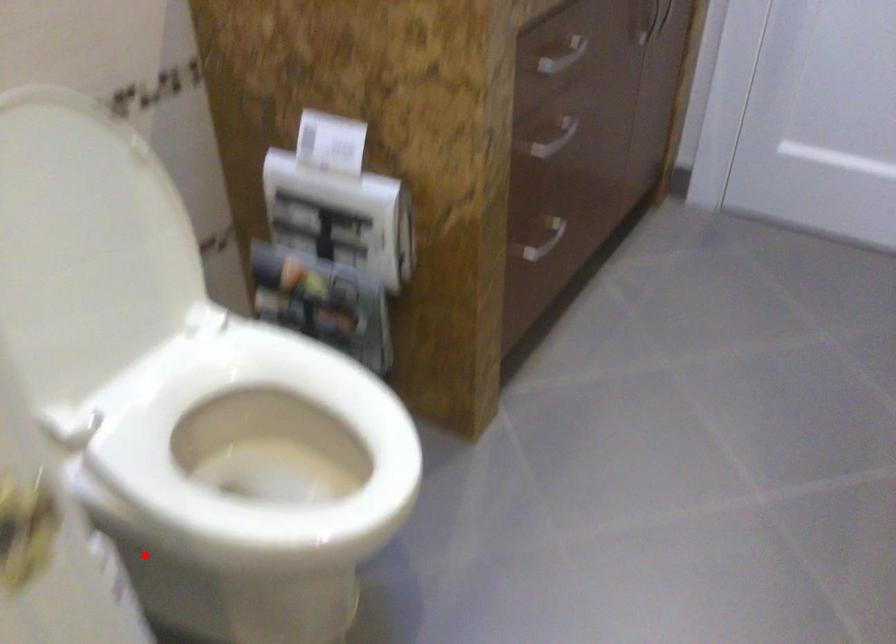
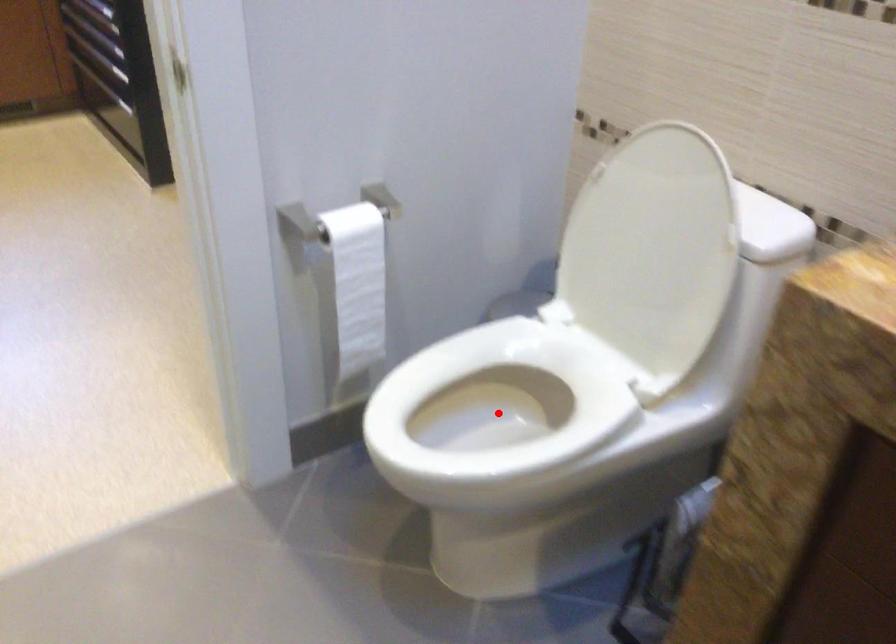
I am providing you with two images of the same scene from different viewpoints. A red point is marked on the first image and another point is marked on the second image. Is the red point in image1 aligned with the point shown in image2?

Yes